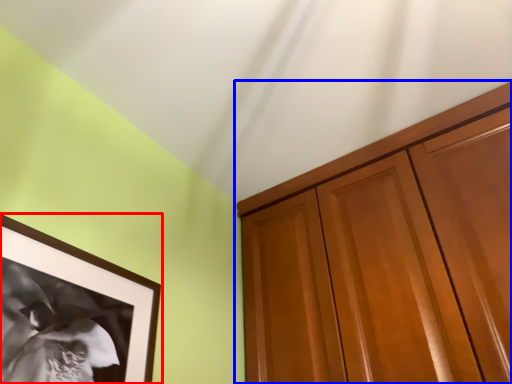
Question: Among these objects, which one is farthest to the camera, picture frame (highlighted by a red box) or cabinetry (highlighted by a blue box)?

Choices:
 (A) picture frame
 (B) cabinetry

Answer: (B)